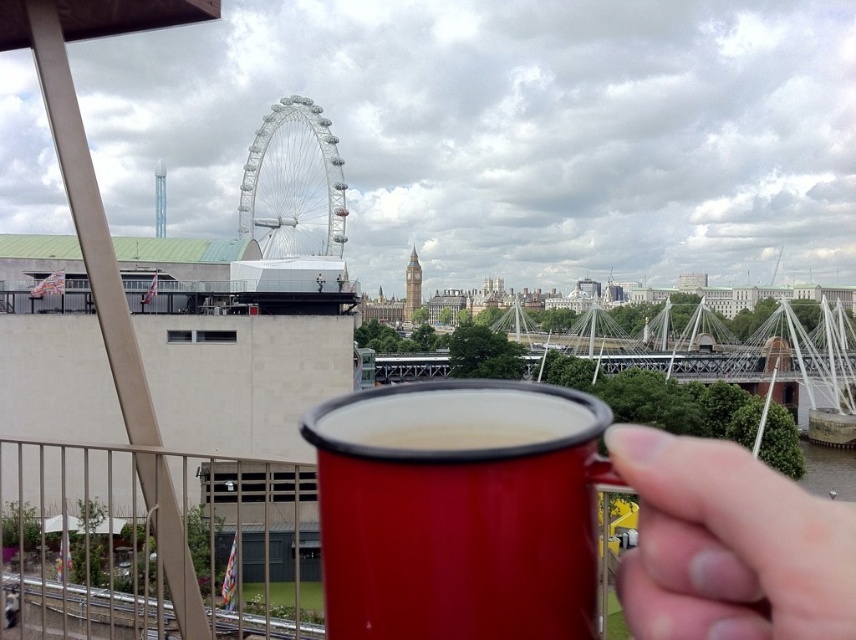
Question: Is matte plastic hand at lower right wider than white metallic ferris wheel at center?

Choices:
 (A) no
 (B) yes

Answer: (A)

Question: Is matte plastic hand at lower right smaller than red matte mug at center?

Choices:
 (A) yes
 (B) no

Answer: (B)

Question: Considering the real-world distances, which object is closest to the glossy enamel mug at lower right?

Choices:
 (A) white metallic ferris wheel at center
 (B) red matte mug at center

Answer: (B)

Question: Which point is closer to the camera taking this photo?

Choices:
 (A) (771, 552)
 (B) (300, 179)
 (C) (522, 416)

Answer: (A)

Question: Does matte plastic hand at lower right appear on the right side of white metallic ferris wheel at center?

Choices:
 (A) yes
 (B) no

Answer: (A)

Question: Which point appears farthest from the camera in this image?

Choices:
 (A) coord(271,176)
 (B) coord(603,422)

Answer: (A)